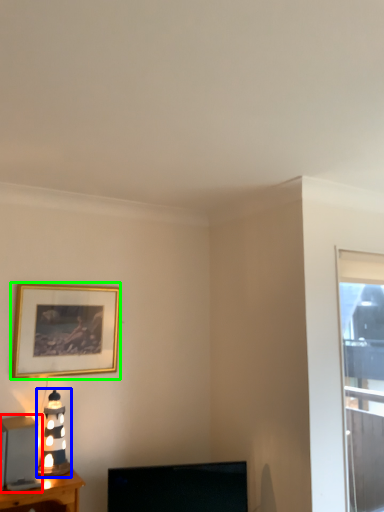
Question: Which object is positioned closest to appliance (highlighted by a red box)? Select from table lamp (highlighted by a blue box) and picture frame (highlighted by a green box).

Choices:
 (A) table lamp
 (B) picture frame

Answer: (A)